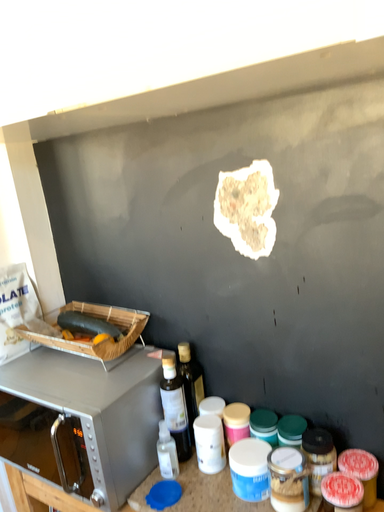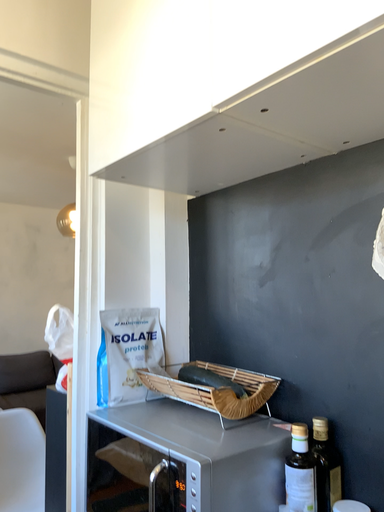
Question: Which way did the camera rotate in the video?

Choices:
 (A) rotated left
 (B) rotated right

Answer: (A)